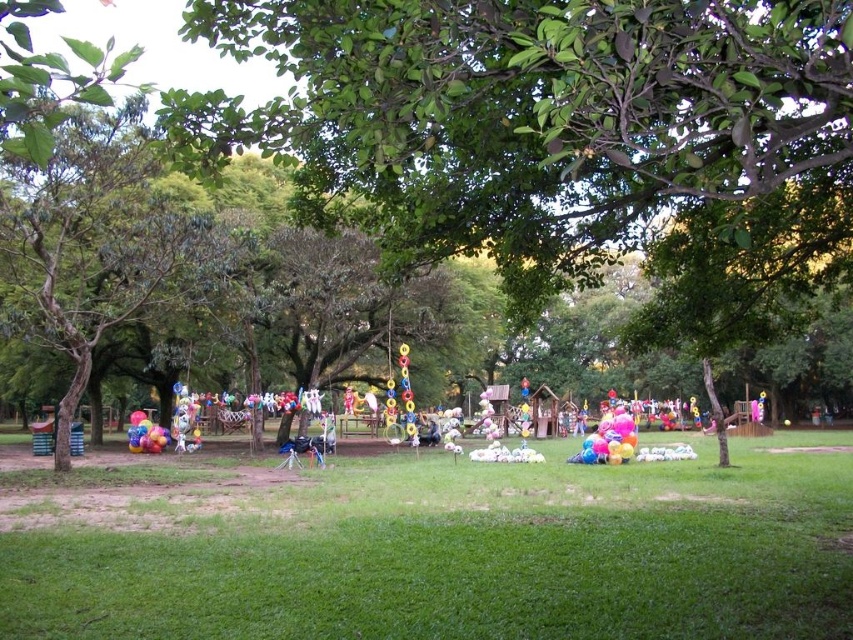
Does green leafy tree at center appear under green grass at center?

Incorrect, green leafy tree at center is not positioned below green grass at center.

Does green leafy tree at center lie in front of green grass at center?

Yes.

Image resolution: width=853 pixels, height=640 pixels. In order to click on green leafy tree at center in this screenshot , I will do `click(555, 131)`.